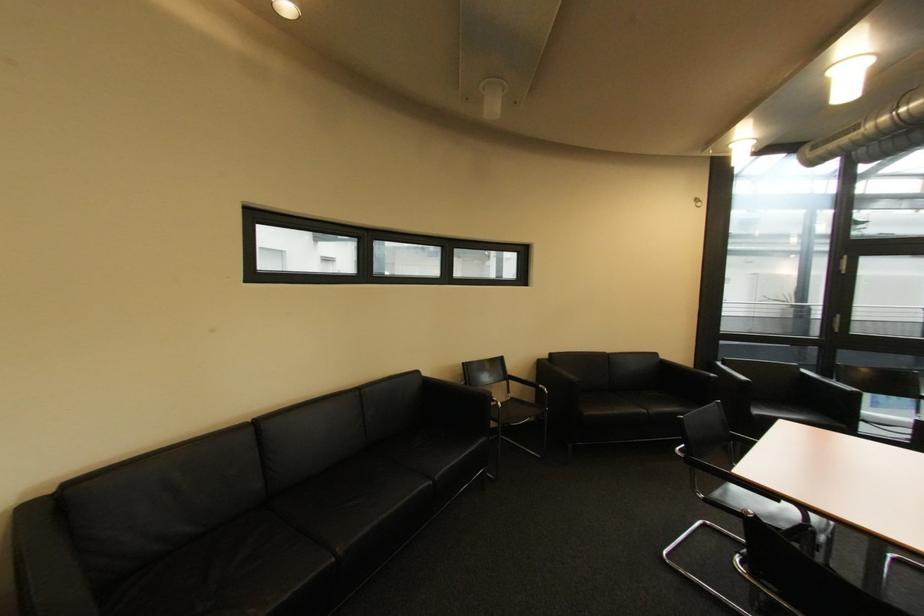
Find the location of a particular element. This screenshot has width=924, height=616. black sofa armrest is located at coordinates 444,403.